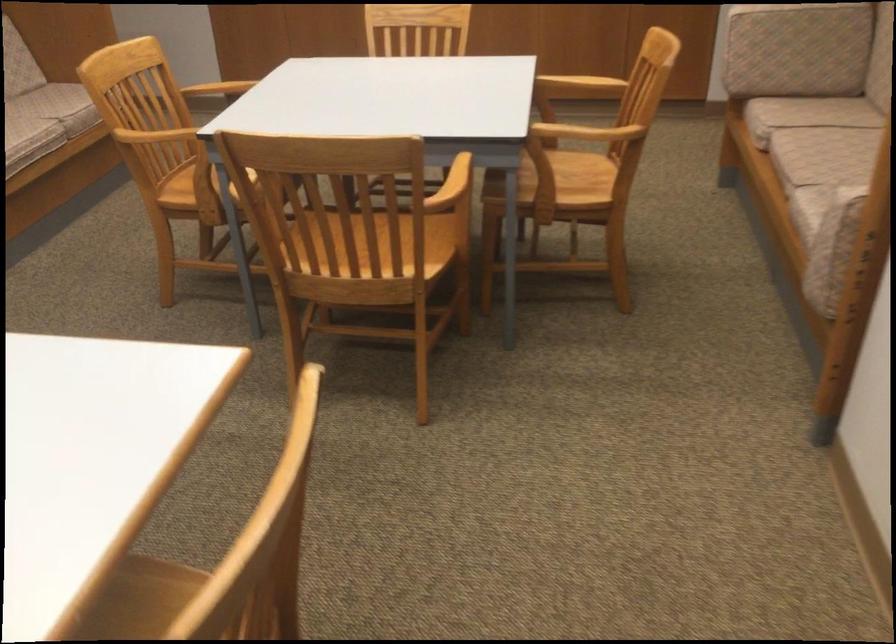
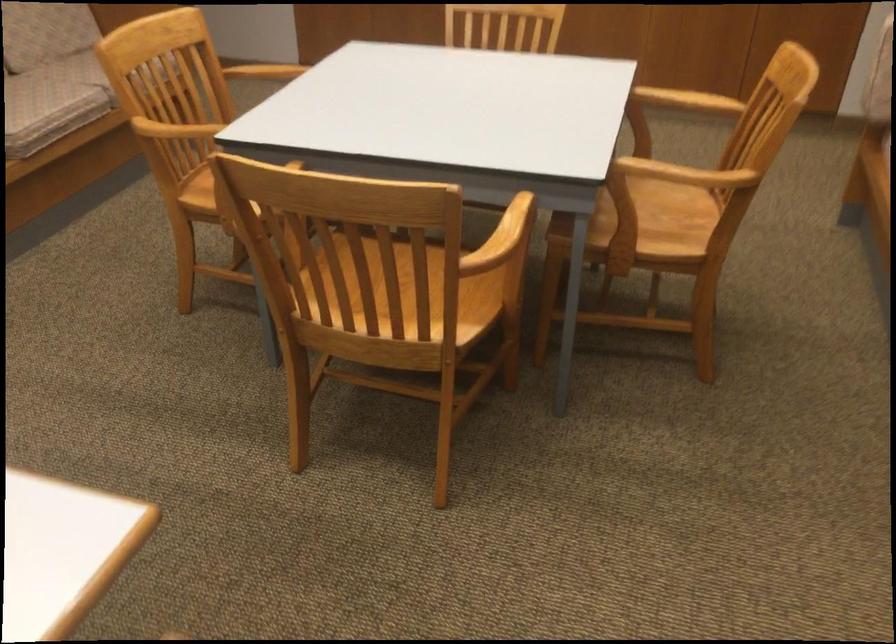
Question: In a continuous first-person perspective shot, in which direction is the camera moving?

Choices:
 (A) Left
 (B) Right
 (C) Forward
 (D) Backward

Answer: (C)